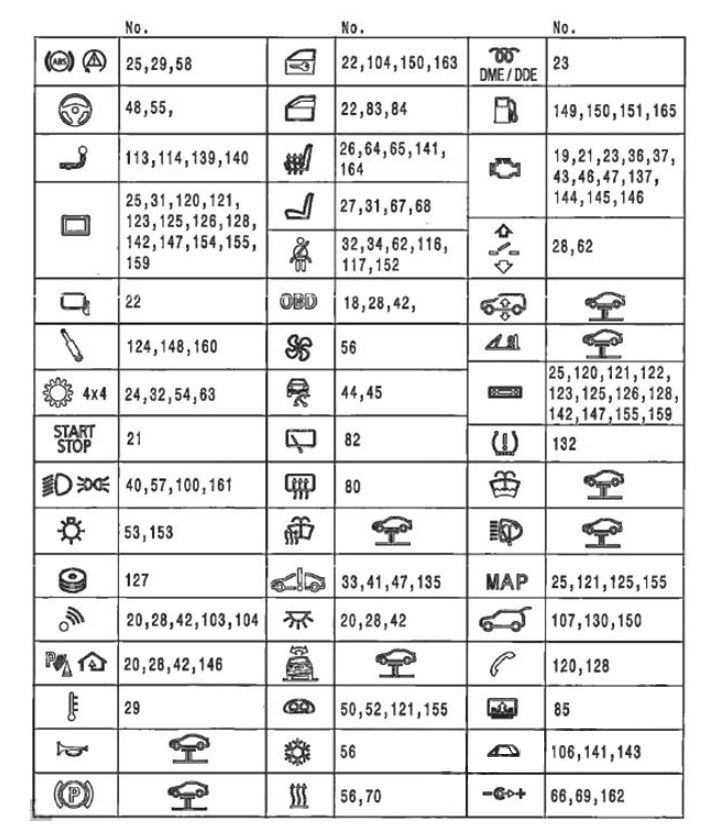
You are a GUI agent. You are given a task and a screenshot of the screen. Output one action in this format:
    pyautogui.click(x=<x>, y=<y>)
    Task: Click on the lift
    The height and width of the screenshot is (836, 705).
    Given the screenshot: What is the action you would take?
    point(390,656), point(302,803)